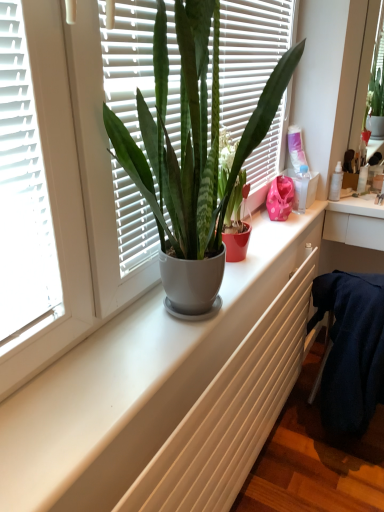
Locate an element on the screen. The width and height of the screenshot is (384, 512). white matte radiator at center is located at coordinates (231, 412).

Looking at this image, based on their sizes in the image, would you say matte white pot at center is bigger or smaller than transparent plastic bottle at upper right?

Considering their sizes, matte white pot at center takes up more space than transparent plastic bottle at upper right.

You are a GUI agent. You are given a task and a screenshot of the screen. Output one action in this format:
    pyautogui.click(x=<x>, y=<y>)
    Task: Click on the houseplant that is in front of the transparent plastic bottle at upper right
    Image resolution: width=384 pixels, height=512 pixels.
    Given the screenshot: What is the action you would take?
    pyautogui.click(x=191, y=134)

Does matte white pot at center lie behind transparent plastic bottle at upper right?

No, matte white pot at center is closer to the viewer.

From the image's perspective, relative to transparent plastic bottle at upper right, is matte white pot at center above or below?

matte white pot at center is above transparent plastic bottle at upper right.

Can you confirm if white matte radiator at center is bigger than matte white pot at center?

Yes, white matte radiator at center is bigger than matte white pot at center.

Between white matte radiator at center and matte white pot at center, which one has smaller width?

Thinner between the two is matte white pot at center.

From the image's perspective, is white matte radiator at center located above matte white pot at center?

No, from the image's perspective, white matte radiator at center is not on top of matte white pot at center.

Is white matte radiator at center taller or shorter than matte white pot at center?

white matte radiator at center is shorter than matte white pot at center.

At what (x,y) coordinates should I click in order to perform the action: click on houseplant above the transparent plastic bottle at upper right (from the image's perspective). Please return your answer as a coordinate pair (x, y). The width and height of the screenshot is (384, 512). Looking at the image, I should click on (191, 134).

Who is shorter, transparent plastic bottle at upper right or matte white pot at center?

With less height is transparent plastic bottle at upper right.

Is transparent plastic bottle at upper right outside of matte white pot at center?

Yes.

From the image's perspective, is transparent plastic bottle at upper right positioned above or below matte white pot at center?

Clearly, from the image's perspective, transparent plastic bottle at upper right is below matte white pot at center.

Find the location of `window box on the right of white matte radiator at center`. window box on the right of white matte radiator at center is located at coordinates (304, 190).

Considering the sizes of white matte radiator at center and transparent plastic bottle at upper right in the image, is white matte radiator at center wider or thinner than transparent plastic bottle at upper right?

Considering their sizes, white matte radiator at center looks broader than transparent plastic bottle at upper right.

Is white matte radiator at center not inside transparent plastic bottle at upper right?

Yes.

Who is more distant, white matte radiator at center or transparent plastic bottle at upper right?

transparent plastic bottle at upper right is behind.

Consider the image. Is transparent plastic bottle at upper right positioned before white matte radiator at center?

No.

Is transparent plastic bottle at upper right positioned with its back to white matte radiator at center?

That's not correct — transparent plastic bottle at upper right is not looking away from white matte radiator at center.

Can you tell me how much transparent plastic bottle at upper right and white matte radiator at center differ in facing direction?

The angular difference between transparent plastic bottle at upper right and white matte radiator at center is 3.12 degrees.

Find the location of a particular element. Image resolution: width=384 pixels, height=512 pixels. window box that is above the white matte radiator at center (from a real-world perspective) is located at coordinates point(304,190).

Considering the relative sizes of matte white pot at center and white matte radiator at center in the image provided, is matte white pot at center smaller than white matte radiator at center?

Indeed, matte white pot at center has a smaller size compared to white matte radiator at center.

Locate an element on the screen. radiator below the matte white pot at center (from a real-world perspective) is located at coordinates (231, 412).

Based on the photo, can you tell me how much matte white pot at center and white matte radiator at center differ in facing direction?

0.459 degrees separate the facing orientations of matte white pot at center and white matte radiator at center.

Would you say matte white pot at center is inside or outside white matte radiator at center?

The correct answer is: outside.

Locate an element on the screen. The image size is (384, 512). houseplant above the transparent plastic bottle at upper right (from a real-world perspective) is located at coordinates (191, 134).

Find the location of a particular element. This screenshot has height=512, width=384. radiator in front of the matte white pot at center is located at coordinates (231, 412).

Considering their positions, is transparent plastic bottle at upper right positioned closer to matte white pot at center than white matte radiator at center?

white matte radiator at center lies closer to matte white pot at center than the other object.

From the image, which object appears to be farther from white matte radiator at center, transparent plastic bottle at upper right or matte white pot at center?

transparent plastic bottle at upper right.

Based on their spatial positions, is matte white pot at center or transparent plastic bottle at upper right closer to white matte radiator at center?

matte white pot at center.

Which object lies nearer to the anchor point transparent plastic bottle at upper right, white matte radiator at center or matte white pot at center?

white matte radiator at center.

Considering their positions, is white matte radiator at center positioned further to matte white pot at center than transparent plastic bottle at upper right?

transparent plastic bottle at upper right is positioned further to the anchor matte white pot at center.

Estimate the real-world distances between objects in this image. Which object is further from transparent plastic bottle at upper right, matte white pot at center or white matte radiator at center?

matte white pot at center is further to transparent plastic bottle at upper right.

Where is `houseplant between white matte radiator at center and transparent plastic bottle at upper right in the front-back direction`? houseplant between white matte radiator at center and transparent plastic bottle at upper right in the front-back direction is located at coordinates (191, 134).